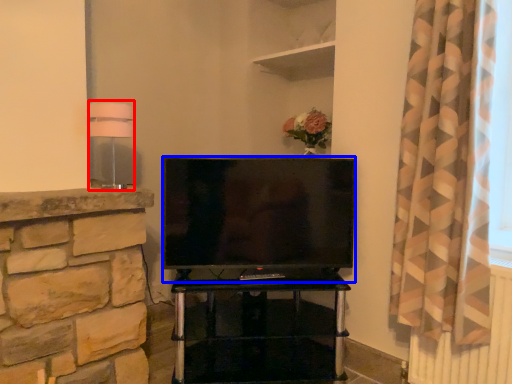
Question: Which of the following is the farthest to the observer, lamp (highlighted by a red box) or television (highlighted by a blue box)?

Choices:
 (A) lamp
 (B) television

Answer: (B)